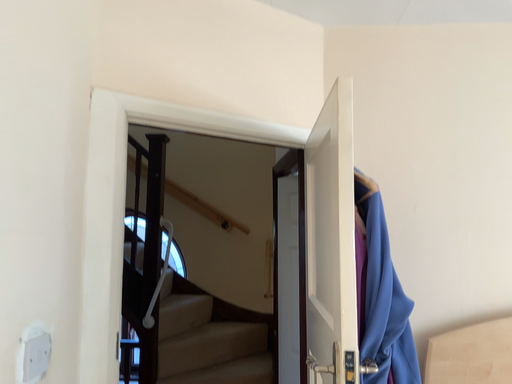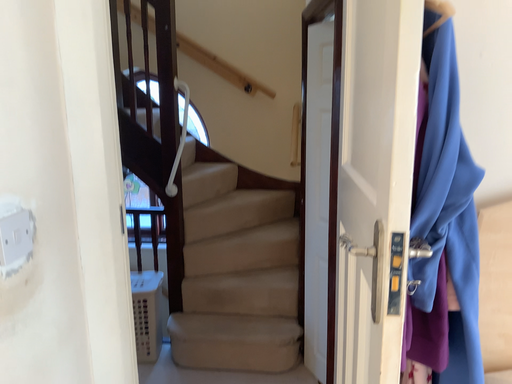
Question: Which way did the camera rotate in the video?

Choices:
 (A) rotated downward
 (B) rotated upward

Answer: (A)